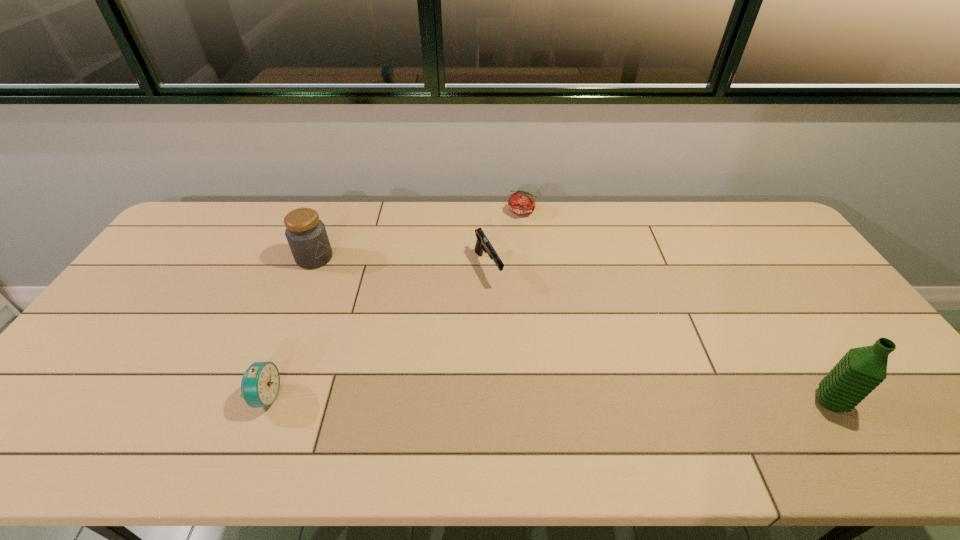
The width and height of the screenshot is (960, 540). Identify the location of free space on the desktop that is between the alarm clock and the tallest object and is positioned on the surface of the jar near the warning symbol. (501, 399).

The height and width of the screenshot is (540, 960). In order to click on vacant spot on the desktop that is between the alarm clock and the water bottle and is positioned at the aiming end of the gun in this screenshot , I will do `click(566, 399)`.

Where is `free space on the desktop that is between the alarm clock and the tallest object and is positioned on the front-facing side of the shortest object`? The height and width of the screenshot is (540, 960). free space on the desktop that is between the alarm clock and the tallest object and is positioned on the front-facing side of the shortest object is located at coordinates (607, 400).